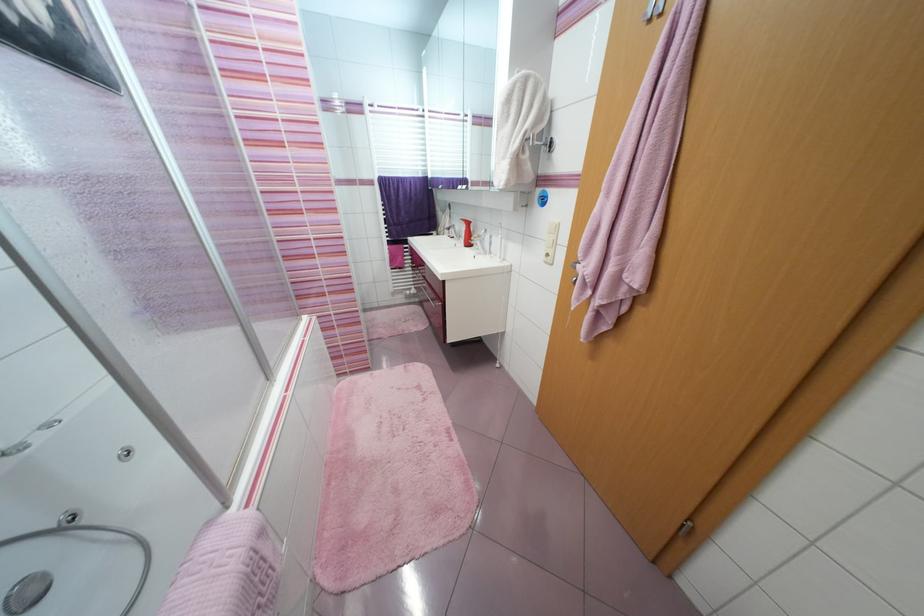
What are the coordinates of `red soap dispenser` in the screenshot? It's located at (467, 233).